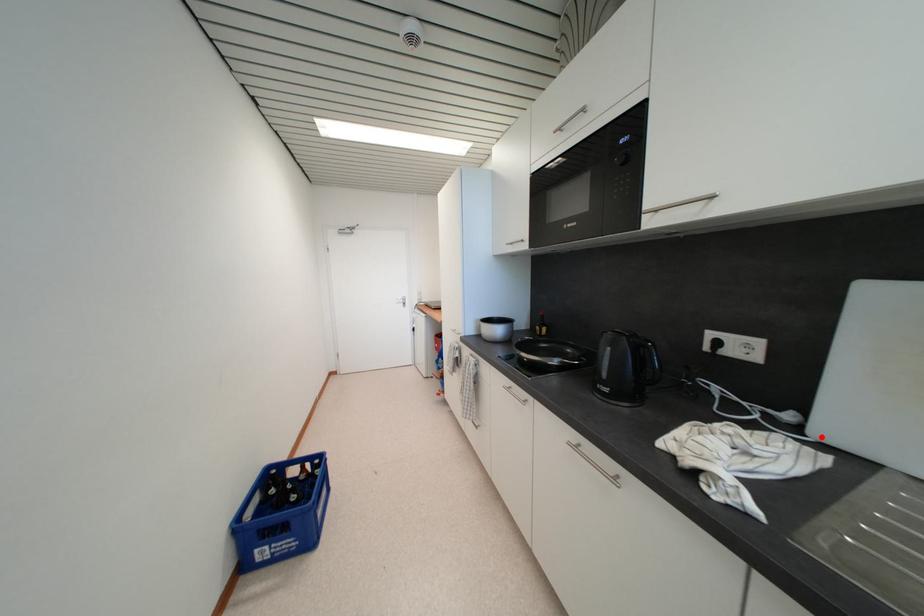
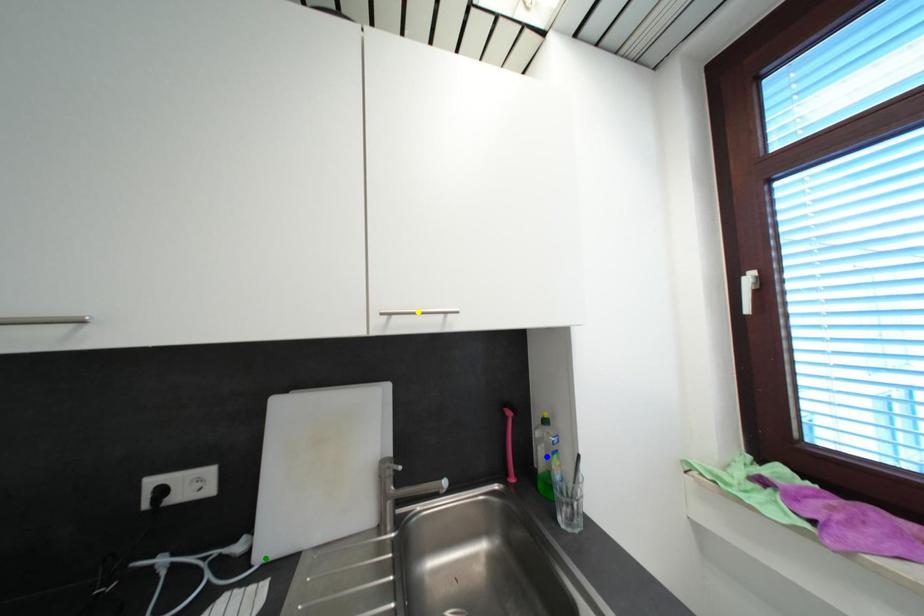
Question: I am providing you with two images of the same scene from different viewpoints. A red point is marked on the first image. You are given multiple points on the second image. Which point in image 2 represents the same 3d spot as the red point in image 1?

Choices:
 (A) green point
 (B) blue point
 (C) yellow point

Answer: (A)